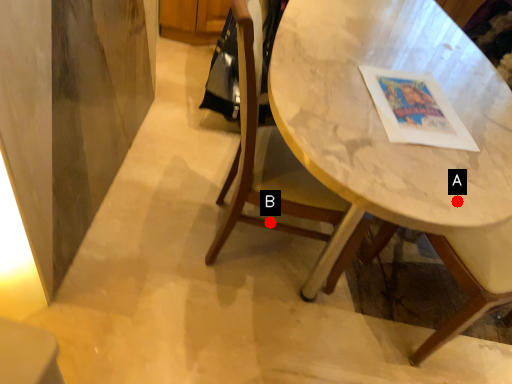
Question: Two points are circled on the image, labeled by A and B beside each circle. Which point is closer to the camera?

Choices:
 (A) A is closer
 (B) B is closer

Answer: (A)